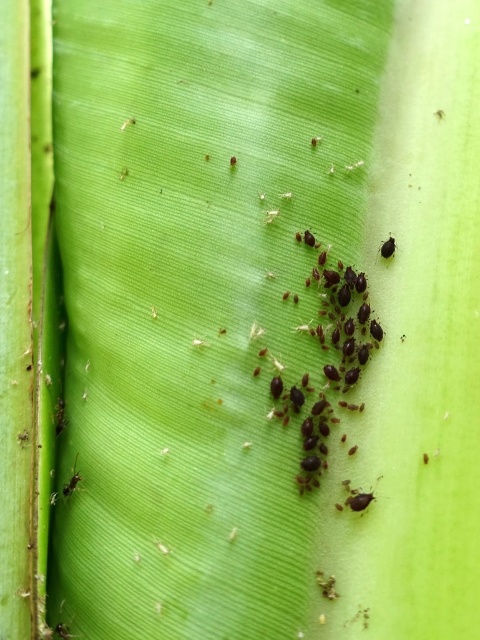
Is black matte insects at center smaller than black matte ant at lower left?

No, black matte insects at center is not smaller than black matte ant at lower left.

Does point (276, 412) come farther from viewer compared to point (75, 477)?

No, (276, 412) is closer to viewer.

Image resolution: width=480 pixels, height=640 pixels. I want to click on black matte insects at center, so click(327, 365).

Is black matte insects at center wider than black matte insect at upper right?

Indeed, black matte insects at center has a greater width compared to black matte insect at upper right.

Which is below, black matte insects at center or black matte insect at upper right?

Positioned lower is black matte insects at center.

Does point (321, 308) come in front of point (392, 236)?

Yes, point (321, 308) is in front of point (392, 236).

Identify the location of black matte insects at center. coord(327,365).

Does point (72, 488) come farther from viewer compared to point (380, 253)?

No, it is in front of (380, 253).

Which is below, black matte ant at lower left or black matte insect at upper right?

black matte ant at lower left is lower down.

Image resolution: width=480 pixels, height=640 pixels. What are the coordinates of `black matte ant at lower left` in the screenshot? It's located at (72, 481).